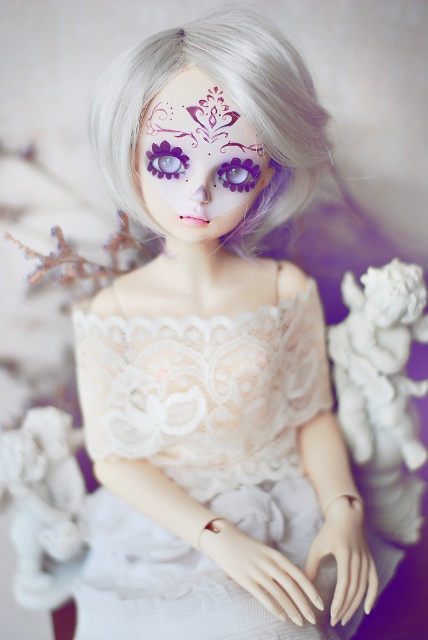
Based on the scene description, which object is positioned lower in the image? The lace fabric dress at center or the matte purple face at center?

The lace fabric dress at center is positioned below the matte purple face at center, so the lace fabric dress at center is lower in the image.

You are an art collector examining a doll displayed in a glass case. You notice a point marked at coordinates (383, 392) on the image. Based on the scene description, what object is located at this point?

The point at coordinates (383, 392) marks the location of the white porcelain cherub at lower right.